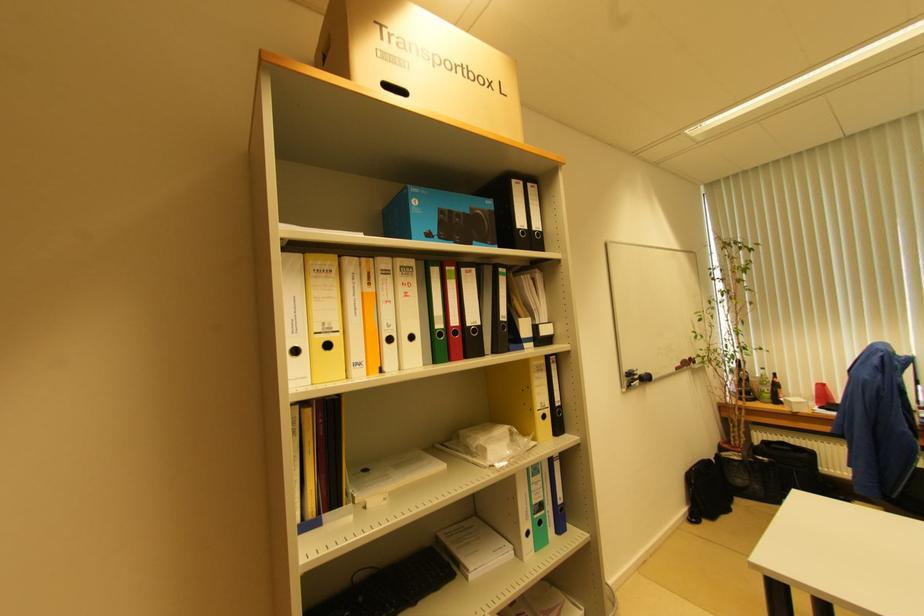
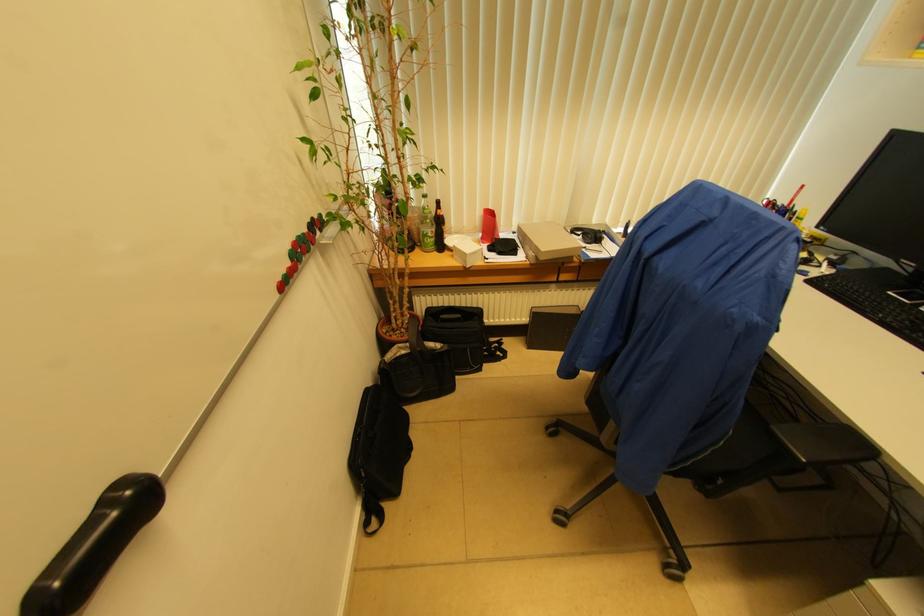
Where in the second image is the point corresponding to pixel 640 379 from the first image?

(35, 600)